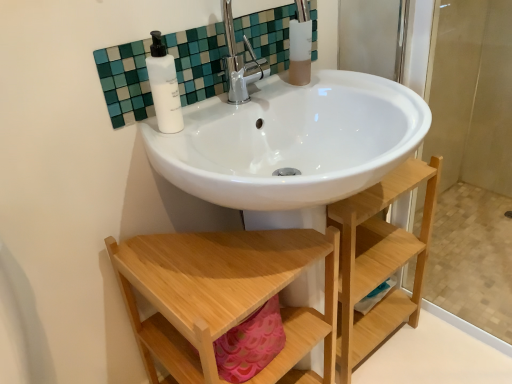
You are a GUI agent. You are given a task and a screenshot of the screen. Output one action in this format:
    pyautogui.click(x=<x>, y=<y>)
    Task: Click on the vacant space to the left of translucent frosted glass cup at upper center
    This screenshot has height=384, width=512.
    Given the screenshot: What is the action you would take?
    pyautogui.click(x=250, y=99)